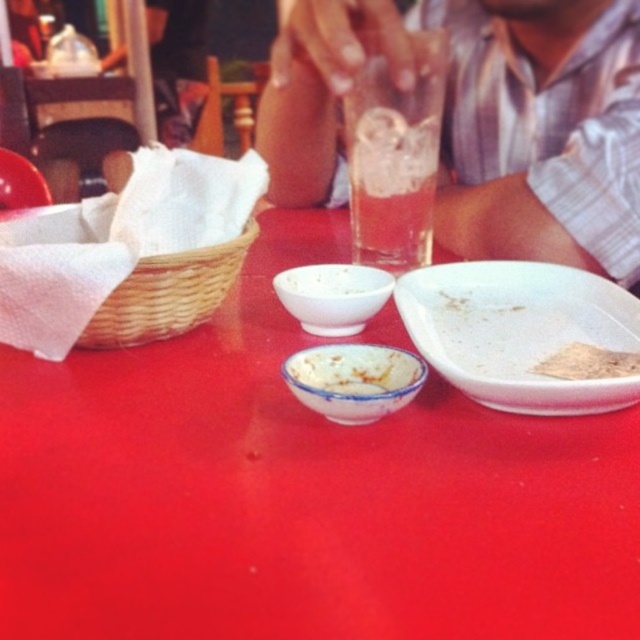
Can you confirm if white glossy bowl at center is taller than matte white bowl at left?

No.

Which is above, white glossy bowl at center or matte white bowl at left?

matte white bowl at left is above.

Who is more distant from viewer, (356, 323) or (28, 177)?

Point (28, 177)

Locate an element on the screen. This screenshot has width=640, height=640. white glossy bowl at center is located at coordinates (332, 296).

Who is positioned more to the left, white matte plate at center or white ceramic bowl at center?

From the viewer's perspective, white ceramic bowl at center appears more on the left side.

Can you confirm if white matte plate at center is positioned above white ceramic bowl at center?

Yes.

Does point (502, 280) come closer to viewer compared to point (392, 371)?

No, (502, 280) is further to viewer.

Where is `white matte plate at center`? white matte plate at center is located at coordinates (518, 332).

The height and width of the screenshot is (640, 640). What do you see at coordinates (332, 280) in the screenshot?
I see `white matte bowl at center` at bounding box center [332, 280].

This screenshot has width=640, height=640. Identify the location of white matte bowl at center. (332, 280).

You are a GUI agent. You are given a task and a screenshot of the screen. Output one action in this format:
    pyautogui.click(x=<x>, y=<y>)
    Task: Click on the white matte bowl at center
    This screenshot has height=640, width=640.
    Given the screenshot: What is the action you would take?
    pyautogui.click(x=332, y=280)